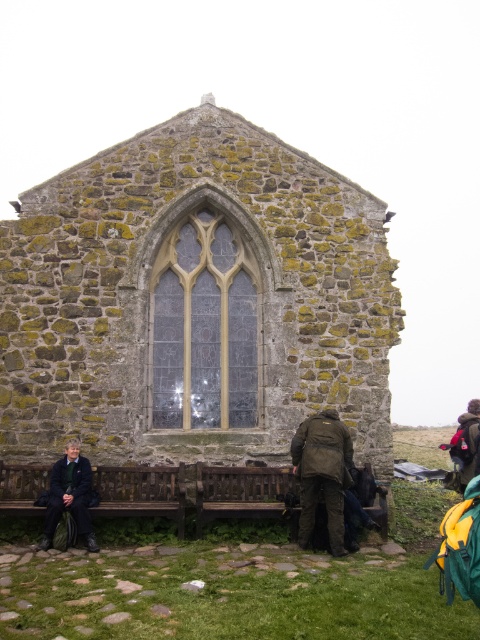
Question: Does stone wall with arched window at center appear over green fabric jacket at center?

Choices:
 (A) no
 (B) yes

Answer: (B)

Question: Among these objects, which one is nearest to the camera?

Choices:
 (A) wooden bench at center
 (B) stone wall with arched window at center

Answer: (A)

Question: Which object is farther from the camera taking this photo?

Choices:
 (A) wooden bench at center
 (B) dark green fabric jacket at lower left
 (C) stone wall with arched window at center
 (D) green fabric jacket at center

Answer: (C)

Question: Is wooden bench at center to the right of green fabric jacket at center from the viewer's perspective?

Choices:
 (A) no
 (B) yes

Answer: (A)

Question: Among these objects, which one is nearest to the camera?

Choices:
 (A) dark green fabric jacket at lower left
 (B) stone wall with arched window at center

Answer: (A)

Question: Is green fabric jacket at center smaller than dark green fabric jacket at lower left?

Choices:
 (A) yes
 (B) no

Answer: (A)